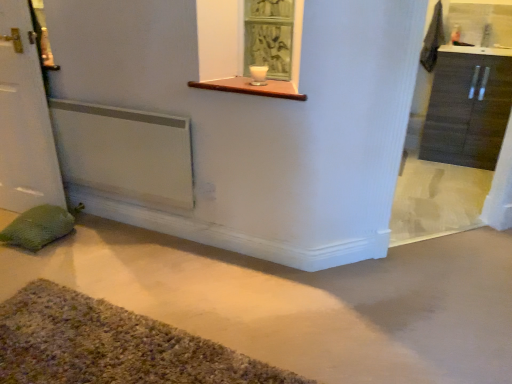
Question: Does white matte door at left have a greater width compared to wooden at upper center?

Choices:
 (A) no
 (B) yes

Answer: (A)

Question: Would you say wooden at upper center is part of white matte door at left's contents?

Choices:
 (A) yes
 (B) no

Answer: (B)

Question: From the image's perspective, does white matte door at left appear lower than wooden at upper center?

Choices:
 (A) no
 (B) yes

Answer: (B)

Question: Is white matte door at left located outside wooden at upper center?

Choices:
 (A) no
 (B) yes

Answer: (B)

Question: Is white matte door at left shorter than wooden at upper center?

Choices:
 (A) no
 (B) yes

Answer: (A)

Question: Do you think white matte door at left is within dark wood cabinet at right, or outside of it?

Choices:
 (A) outside
 (B) inside

Answer: (A)

Question: In the image, is white matte door at left positioned in front of or behind dark wood cabinet at right?

Choices:
 (A) behind
 (B) front

Answer: (B)

Question: From a real-world perspective, is white matte door at left above or below dark wood cabinet at right?

Choices:
 (A) above
 (B) below

Answer: (A)

Question: Considering the positions of point (40, 193) and point (435, 140), is point (40, 193) closer or farther from the camera than point (435, 140)?

Choices:
 (A) farther
 (B) closer

Answer: (B)

Question: From a real-world perspective, is smooth concrete floor at center physically located above or below wooden at upper center?

Choices:
 (A) above
 (B) below

Answer: (B)

Question: Which is correct: smooth concrete floor at center is inside wooden at upper center, or outside of it?

Choices:
 (A) outside
 (B) inside

Answer: (A)

Question: Considering the positions of point (450, 288) and point (285, 92), is point (450, 288) closer or farther from the camera than point (285, 92)?

Choices:
 (A) farther
 (B) closer

Answer: (A)

Question: In terms of width, does smooth concrete floor at center look wider or thinner when compared to wooden at upper center?

Choices:
 (A) thin
 (B) wide

Answer: (B)

Question: From their relative heights in the image, would you say smooth concrete floor at center is taller or shorter than white matte door at left?

Choices:
 (A) short
 (B) tall

Answer: (A)

Question: Is point (36, 274) positioned closer to the camera than point (32, 167)?

Choices:
 (A) closer
 (B) farther

Answer: (A)